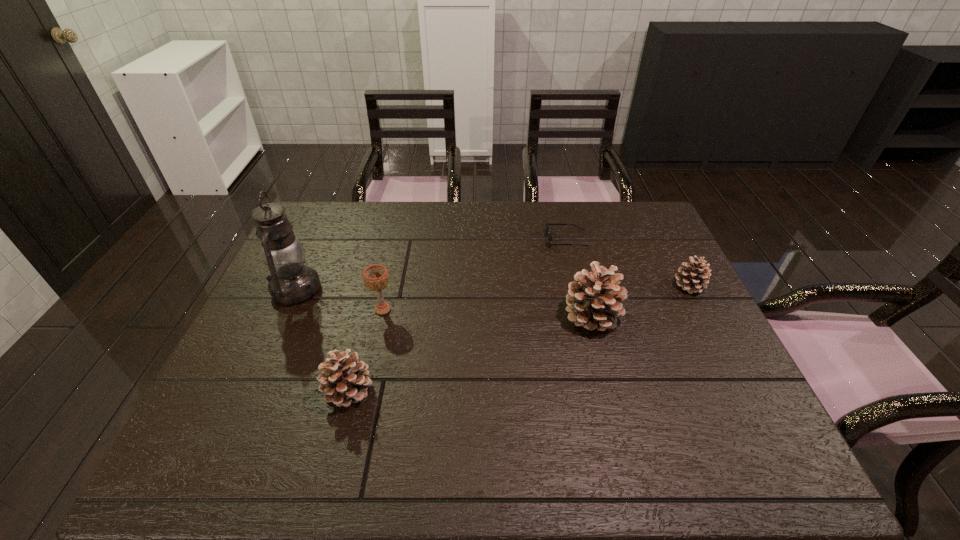
Image resolution: width=960 pixels, height=540 pixels. I want to click on the second shortest pinecone, so click(344, 380).

Locate an element on the screen. The width and height of the screenshot is (960, 540). the nearest object is located at coordinates (344, 380).

Image resolution: width=960 pixels, height=540 pixels. I want to click on the second pinecone from left to right, so click(x=593, y=302).

Identify the location of the fifth shortest object. (593, 302).

Image resolution: width=960 pixels, height=540 pixels. Find the location of `the shortest pinecone`. the shortest pinecone is located at coordinates (694, 278).

At what (x,y) coordinates should I click in order to perform the action: click on the rightmost object. Please return your answer as a coordinate pair (x, y). The height and width of the screenshot is (540, 960). Looking at the image, I should click on (694, 278).

Locate an element on the screen. the shortest object is located at coordinates (547, 224).

The width and height of the screenshot is (960, 540). Identify the location of the farthest object. (547, 224).

Where is `chalice`? chalice is located at coordinates (375, 277).

The width and height of the screenshot is (960, 540). In order to click on the leftmost object in this screenshot , I will do `click(291, 282)`.